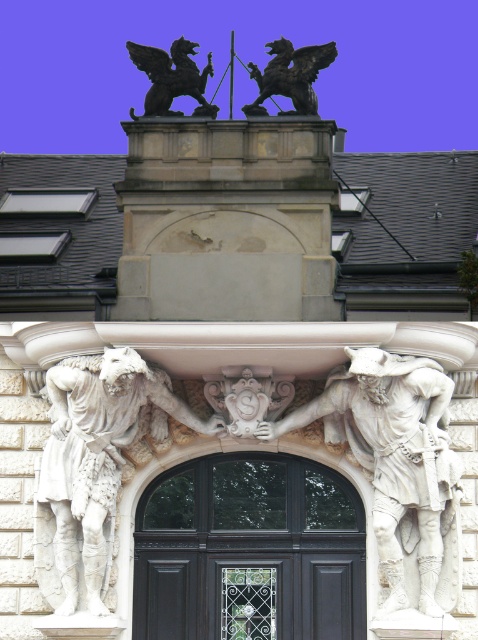
Question: Which is nearer to the white marble statue at center?

Choices:
 (A) black stone griffin at upper center
 (B) black wood door at center
 (C) white marble warrior at center

Answer: (B)

Question: Which is farther from the black stone griffin at upper center?

Choices:
 (A) white marble warrior at center
 (B) black wood door at center
 (C) white marble statue at center
 (D) dark brown stone gargoyle at upper center

Answer: (A)

Question: Is white marble warrior at center above white marble statue at center?

Choices:
 (A) no
 (B) yes

Answer: (A)

Question: Does black wood door at center have a smaller size compared to dark brown stone gargoyle at upper center?

Choices:
 (A) yes
 (B) no

Answer: (A)

Question: Which of the following is the farthest from the observer?

Choices:
 (A) (340, 522)
 (B) (175, 86)

Answer: (B)

Question: Is white marble warrior at center positioned in front of dark brown stone gargoyle at upper center?

Choices:
 (A) yes
 (B) no

Answer: (A)